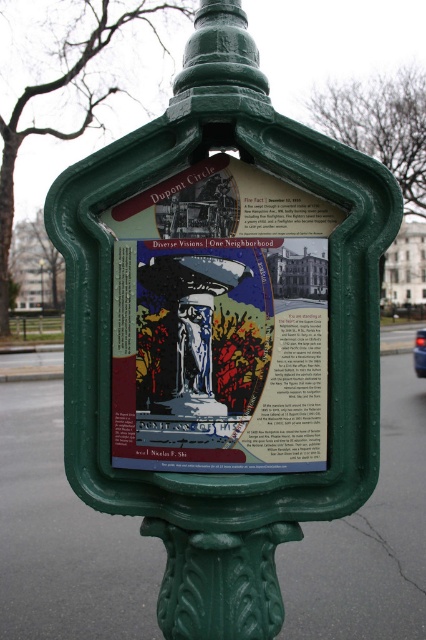
Does matte paper poster at center have a greater width compared to green plastic sign at center?

Indeed, matte paper poster at center has a greater width compared to green plastic sign at center.

Looking at this image, is matte paper poster at center thinner than green plastic sign at center?

No.

Does point (218, 157) come behind point (40, 301)?

No, it is in front of (40, 301).

The image size is (426, 640). I want to click on matte paper poster at center, so click(x=219, y=323).